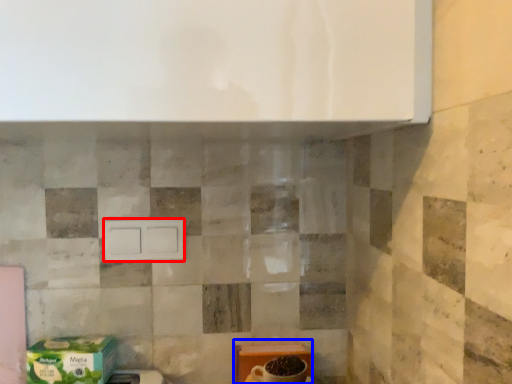
Question: Which object appears farthest to the camera in this image, drawer (highlighted by a red box) or cardboard box (highlighted by a blue box)?

Choices:
 (A) drawer
 (B) cardboard box

Answer: (A)